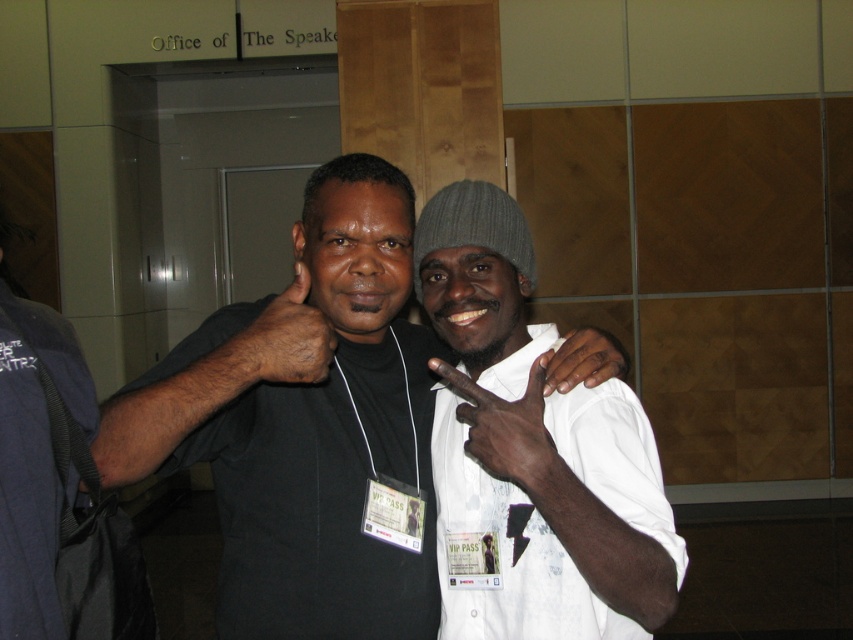
Does white matte shirt at center appear over dark skin/hair at center?

No.

Is white matte shirt at center thinner than dark skin/hair at center?

No.

Which is in front, point (444, 385) or point (253, 321)?

Positioned in front is point (253, 321).

Locate an element on the screen. white matte shirt at center is located at coordinates (503, 552).

The width and height of the screenshot is (853, 640). I want to click on dark skin/hair at center, so click(x=283, y=339).

Between point (242, 355) and point (561, 346), which one is positioned behind?

The point (561, 346) is behind.

Describe the element at coordinates (283, 339) in the screenshot. I see `dark skin/hair at center` at that location.

Where is `dark skin/hair at center`? The image size is (853, 640). dark skin/hair at center is located at coordinates (283, 339).

Can you confirm if black matte shirt at center is smaller than white matte shirt at center?

Actually, black matte shirt at center might be larger than white matte shirt at center.

Which is more to the right, black matte shirt at center or white matte shirt at center?

Positioned to the right is white matte shirt at center.

You are a GUI agent. You are given a task and a screenshot of the screen. Output one action in this format:
    pyautogui.click(x=<x>, y=<y>)
    Task: Click on the black matte shirt at center
    This screenshot has height=640, width=853.
    Given the screenshot: What is the action you would take?
    pyautogui.click(x=305, y=429)